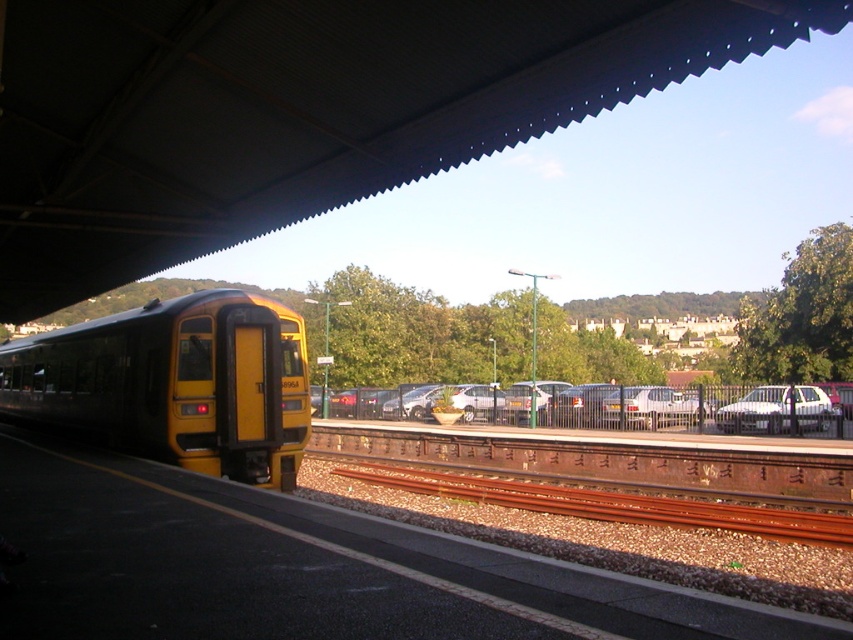
Question: Which point is closer to the camera?

Choices:
 (A) (793, 410)
 (B) (198, 300)
 (C) (811, 416)

Answer: (B)

Question: Is white matte car at right in front of white matte car at center?

Choices:
 (A) yes
 (B) no

Answer: (A)

Question: Does silver metallic car at center have a greater width compared to white matte car at center?

Choices:
 (A) yes
 (B) no

Answer: (A)

Question: Can you confirm if silver metallic car at center is bigger than white matte car at right?

Choices:
 (A) no
 (B) yes

Answer: (B)

Question: Which point appears farthest from the camera in this image?

Choices:
 (A) (662, 394)
 (B) (675, 404)
 (C) (186, 353)
 (D) (802, 385)

Answer: (D)

Question: Considering the real-world distances, which object is closest to the white matte car at right?

Choices:
 (A) white matte car at center
 (B) silver metallic car at center

Answer: (A)